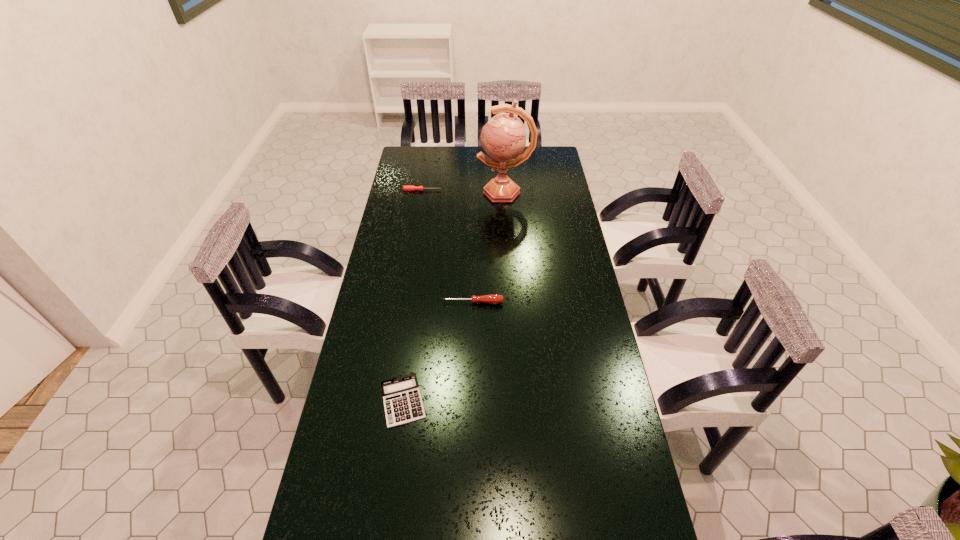
Where is `globe`? The width and height of the screenshot is (960, 540). globe is located at coordinates (503, 137).

Where is `the nearer screwdriver`? This screenshot has height=540, width=960. the nearer screwdriver is located at coordinates (493, 298).

This screenshot has width=960, height=540. Find the location of `the second nearest object`. the second nearest object is located at coordinates (493, 298).

Image resolution: width=960 pixels, height=540 pixels. I want to click on the farther screwdriver, so click(405, 188).

Where is `the left screwdriver`? the left screwdriver is located at coordinates (405, 188).

I want to click on the nearest object, so click(x=402, y=400).

I want to click on blank area located on the front-facing side of the globe, so click(432, 192).

I want to click on blank space located on the front-facing side of the globe, so click(x=462, y=192).

At what (x,y) coordinates should I click in order to perform the action: click on vacant space located on the front-facing side of the globe. Please return your answer as a coordinate pair (x, y). The width and height of the screenshot is (960, 540). Looking at the image, I should click on (432, 192).

Where is `vacant area situated on the front of the right screwdriver`? Image resolution: width=960 pixels, height=540 pixels. vacant area situated on the front of the right screwdriver is located at coordinates (471, 372).